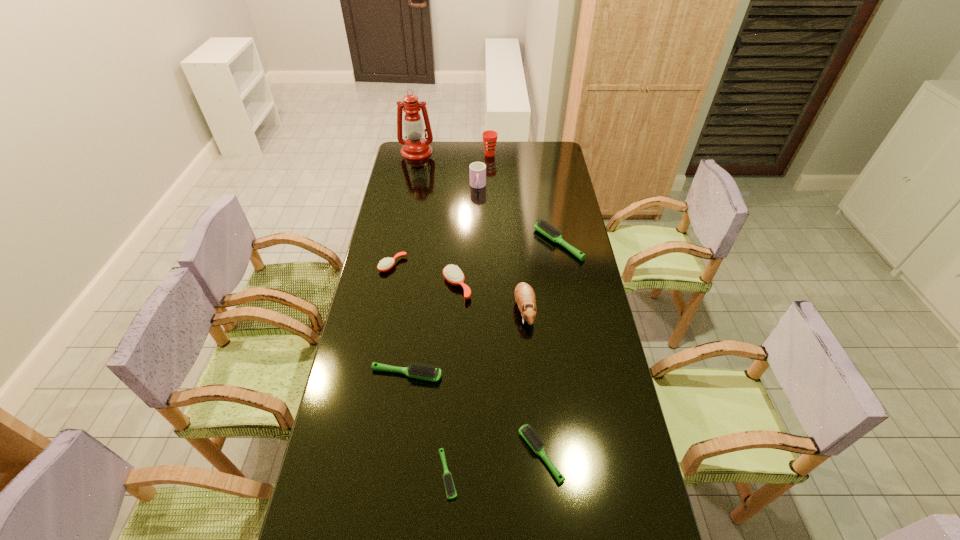
You are a GUI agent. You are given a task and a screenshot of the screen. Output one action in this format:
    pyautogui.click(x=<x>, y=<y>)
    Task: Click on the free space that satisfies the following two spatial constraints: 1. with the handle on the side of the nearer cup; 2. on the right side of the rightmost object
    The height and width of the screenshot is (540, 960).
    Given the screenshot: What is the action you would take?
    pyautogui.click(x=477, y=243)

Where is `blank area in the image that satisfies the following two spatial constraints: 1. on the back side of the right orange hairbrush; 2. on the left side of the third light hairbrush from right to left`? The width and height of the screenshot is (960, 540). blank area in the image that satisfies the following two spatial constraints: 1. on the back side of the right orange hairbrush; 2. on the left side of the third light hairbrush from right to left is located at coordinates (457, 286).

Where is `free spot that satisfies the following two spatial constraints: 1. on the back side of the farther cup; 2. on the left side of the third nearest hairbrush`? The height and width of the screenshot is (540, 960). free spot that satisfies the following two spatial constraints: 1. on the back side of the farther cup; 2. on the left side of the third nearest hairbrush is located at coordinates (436, 154).